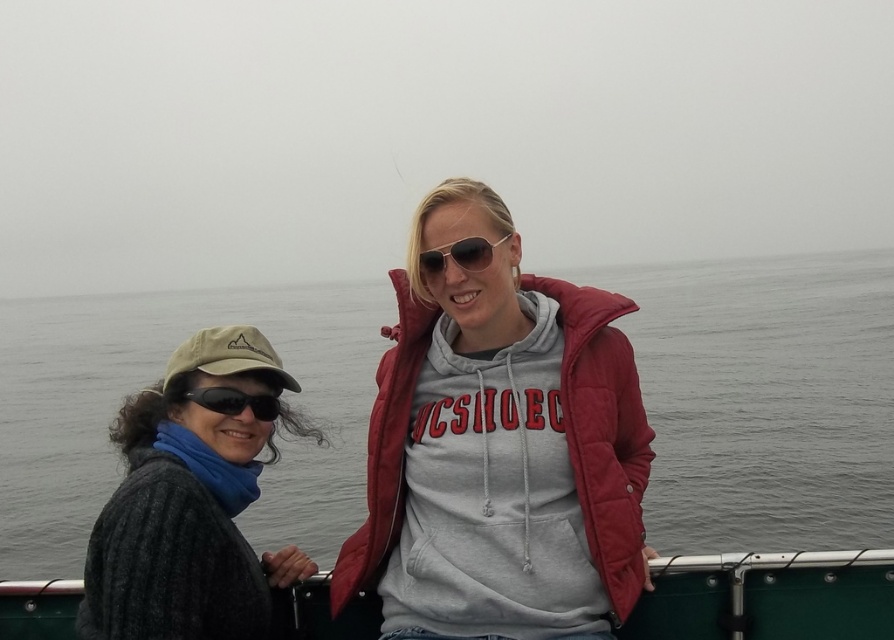
Question: Among these points, which one is nearest to the camera?

Choices:
 (A) (136, 500)
 (B) (277, 410)
 (C) (215, 513)
 (D) (486, 358)

Answer: (A)

Question: Is knitted sweater at left above green knitted sweater at lower left?

Choices:
 (A) no
 (B) yes

Answer: (B)

Question: Which object appears closest to the camera in this image?

Choices:
 (A) matte gray hoodie at center
 (B) matte black sunglasses at center
 (C) black matte sunglasses at left

Answer: (A)

Question: Observing the image, what is the correct spatial positioning of gray water at center in reference to matte gray hoodie at center?

Choices:
 (A) below
 (B) above

Answer: (B)

Question: Does dark gray knit sweater at left appear over matte black sunglasses at center?

Choices:
 (A) no
 (B) yes

Answer: (A)

Question: Which object is farther from the camera taking this photo?

Choices:
 (A) black matte sunglasses at left
 (B) matte gray hoodie at center
 (C) green knitted sweater at lower left
 (D) gray water at center

Answer: (D)